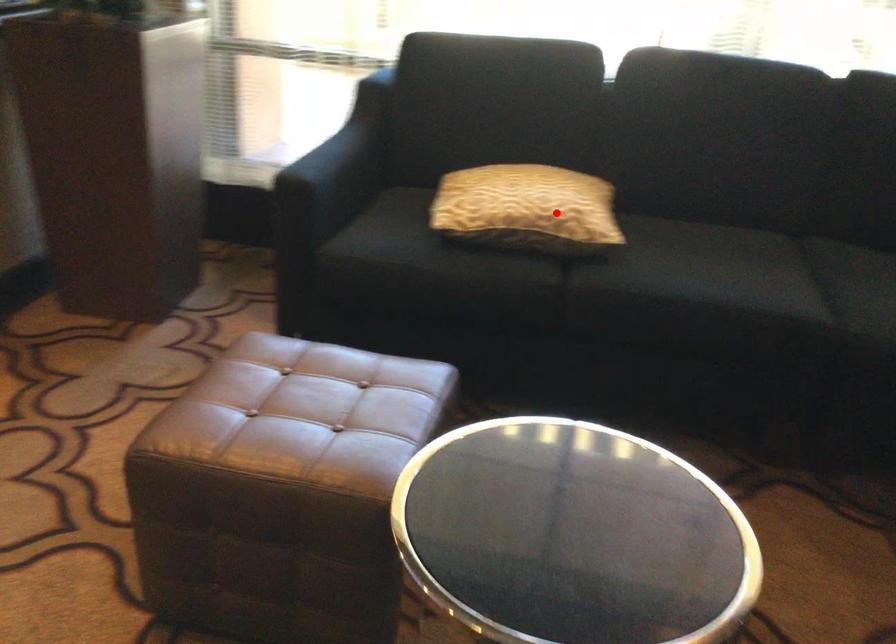
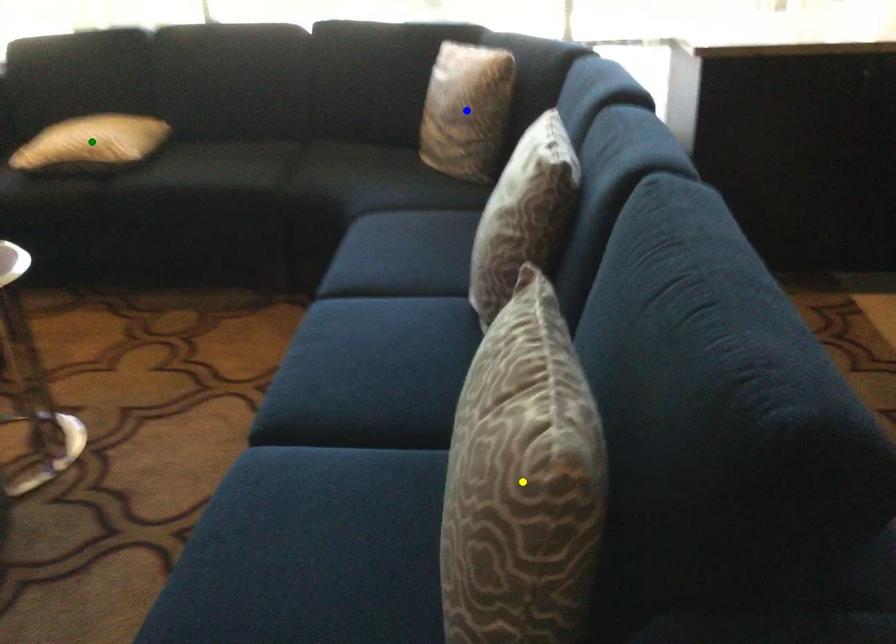
Question: I am providing you with two images of the same scene from different viewpoints. A red point is marked on the first image. You are given multiple points on the second image. Can you choose the point in image 2 that corresponds to the point in image 1?

Choices:
 (A) yellow point
 (B) blue point
 (C) green point

Answer: (C)